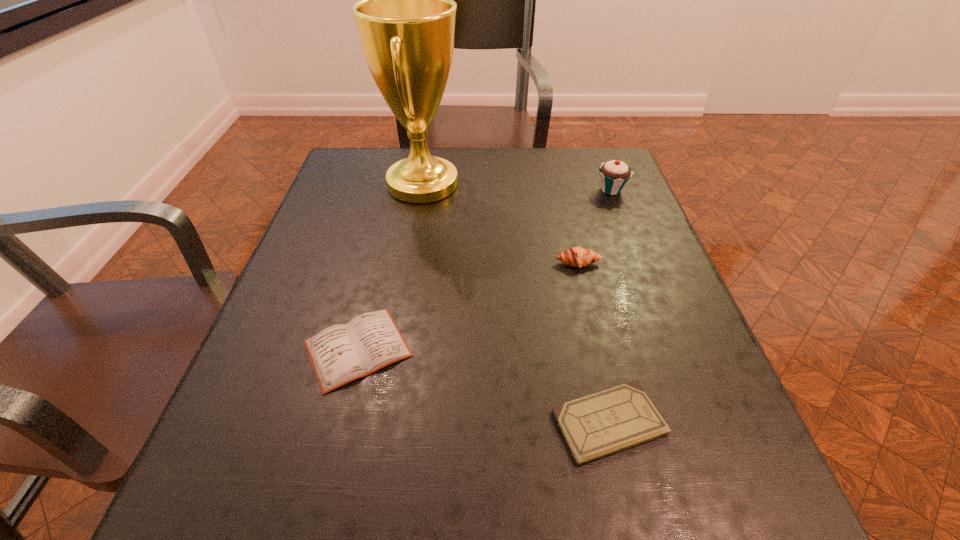
Find the location of a particular element. free space between the checkbook and the third nearest object is located at coordinates (593, 343).

The width and height of the screenshot is (960, 540). What are the coordinates of `unoccupied area between the second tallest object and the pastry` in the screenshot? It's located at (594, 226).

The width and height of the screenshot is (960, 540). What are the coordinates of `unoccupied area between the checkbook and the cupcake` in the screenshot? It's located at (610, 306).

Image resolution: width=960 pixels, height=540 pixels. Find the location of `unoccupied area between the diary and the third shortest object`. unoccupied area between the diary and the third shortest object is located at coordinates (468, 306).

Find the location of a particular element. The image size is (960, 540). free area in between the diary and the third shortest object is located at coordinates (468, 306).

Where is `blank region between the third tallest object and the tallest object`? Image resolution: width=960 pixels, height=540 pixels. blank region between the third tallest object and the tallest object is located at coordinates (500, 224).

You are a GUI agent. You are given a task and a screenshot of the screen. Output one action in this format:
    pyautogui.click(x=<x>, y=<y>)
    Task: Click on the free space between the pastry and the checkbook
    Image resolution: width=960 pixels, height=540 pixels.
    Given the screenshot: What is the action you would take?
    pyautogui.click(x=593, y=343)

This screenshot has width=960, height=540. What are the coordinates of `object that stands as the third closest to the cupcake` in the screenshot? It's located at coord(618,418).

Identify which object is located as the fourth nearest to the tallest object. Please provide its 2D coordinates. Your answer should be formatted as a tuple, i.e. [(x, y)], where the tuple contains the x and y coordinates of a point satisfying the conditions above.

[(618, 418)]

Locate an element on the screen. free point that satisfies the following two spatial constraints: 1. by the handles of the checkbook; 2. on the left side of the award is located at coordinates (382, 422).